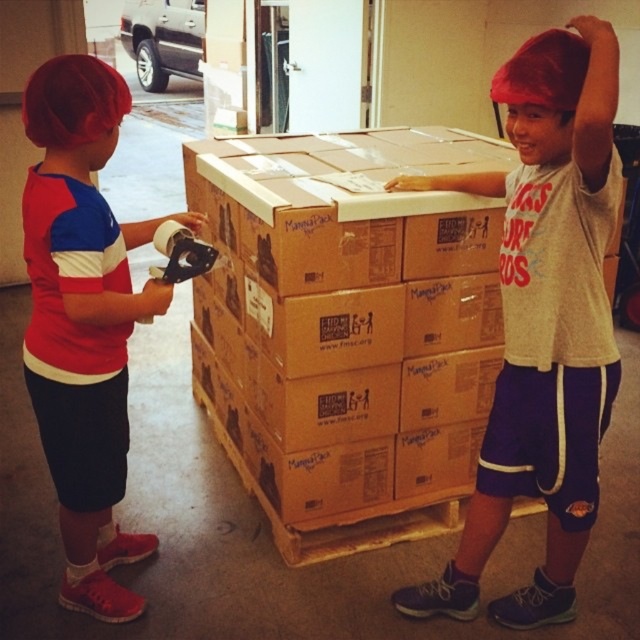
Question: Which object is farther from the camera taking this photo?

Choices:
 (A) matte red hair at left
 (B) matte gray shirt at center

Answer: (A)

Question: Can you confirm if matte gray shirt at center is positioned to the left of matte red hair at left?

Choices:
 (A) no
 (B) yes

Answer: (A)

Question: Which object is farther from the camera taking this photo?

Choices:
 (A) matte red hair at left
 (B) matte gray shirt at center

Answer: (A)

Question: Considering the relative positions of matte gray shirt at center and matte red hair at left in the image provided, where is matte gray shirt at center located with respect to matte red hair at left?

Choices:
 (A) above
 (B) below

Answer: (A)

Question: Does matte gray shirt at center come in front of matte red hair at left?

Choices:
 (A) no
 (B) yes

Answer: (B)